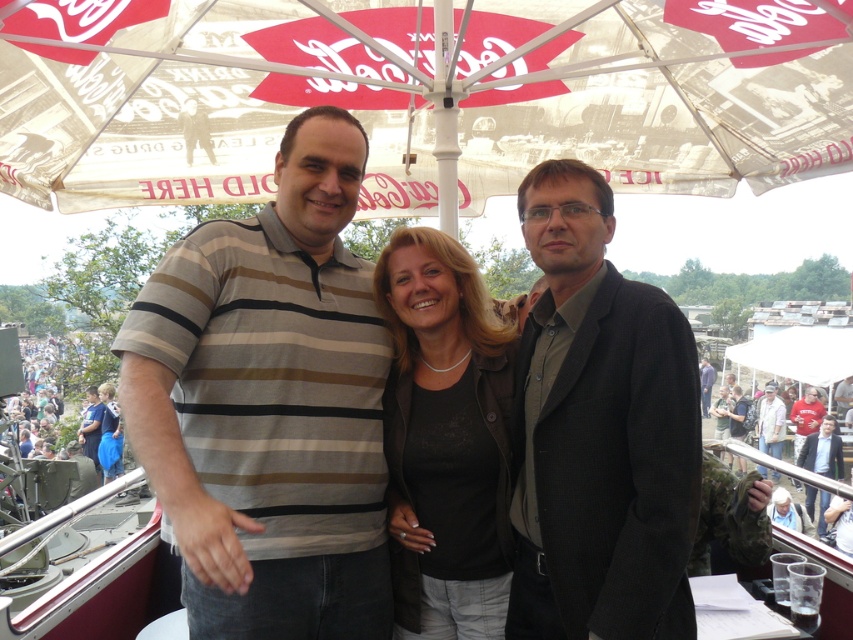
You are at an outdoor event and want to take a photo under the white fabric umbrella at upper center. However, there is a light brown leather jacket at center in the way. Can you move the jacket to the right to get a clear shot under the umbrella?

The white fabric umbrella at upper center is already to the left of the light brown leather jacket at center, so moving the jacket to the right would place it further away from the umbrella, allowing you to take a clear photo under the umbrella.

You are standing at the point marked by the coordinate point at (422, 96). Looking around, you see the white fabric umbrella at upper center. What object is directly above you?

The white fabric umbrella at upper center is directly above the point marked by the coordinate point at (422, 96).

You are a photographer at the event and want to ensure that both the black matte jacket at center and the dark blue shirt at center are clearly visible in the photo. Based on their positions, is there a risk that one might be blocking the other?

The black matte jacket at center is positioned over the dark blue shirt at center, so the dark blue shirt at center could be partially or fully obscured by the black matte jacket at center in the photo.